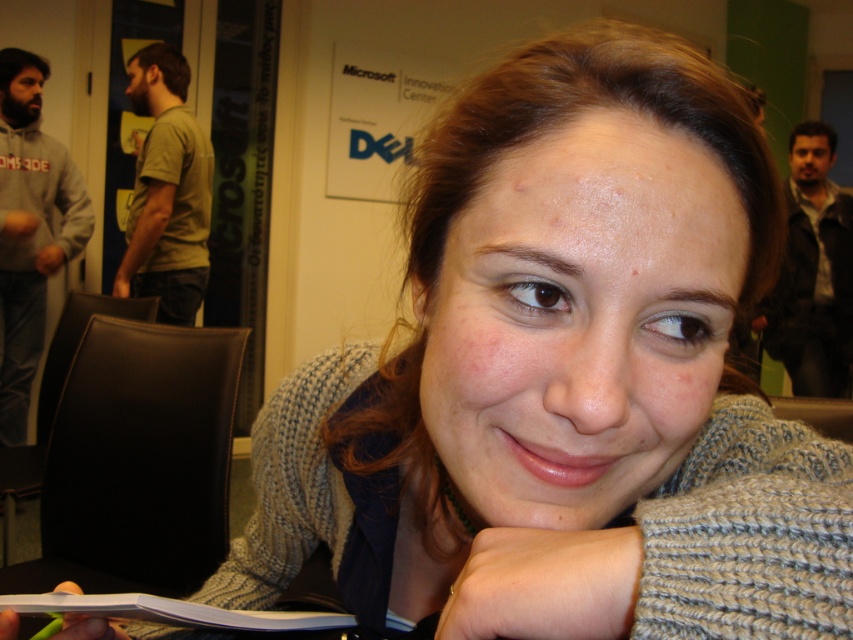
Question: Which point appears farthest from the camera in this image?

Choices:
 (A) (35, 342)
 (B) (183, 72)

Answer: (A)

Question: Is gray hoodie at left behind green t-shirt at left?

Choices:
 (A) no
 (B) yes

Answer: (B)

Question: Can you confirm if gray hoodie at left is positioned below green t-shirt at left?

Choices:
 (A) no
 (B) yes

Answer: (B)

Question: Does gray hoodie at left appear on the left side of green t-shirt at left?

Choices:
 (A) yes
 (B) no

Answer: (A)